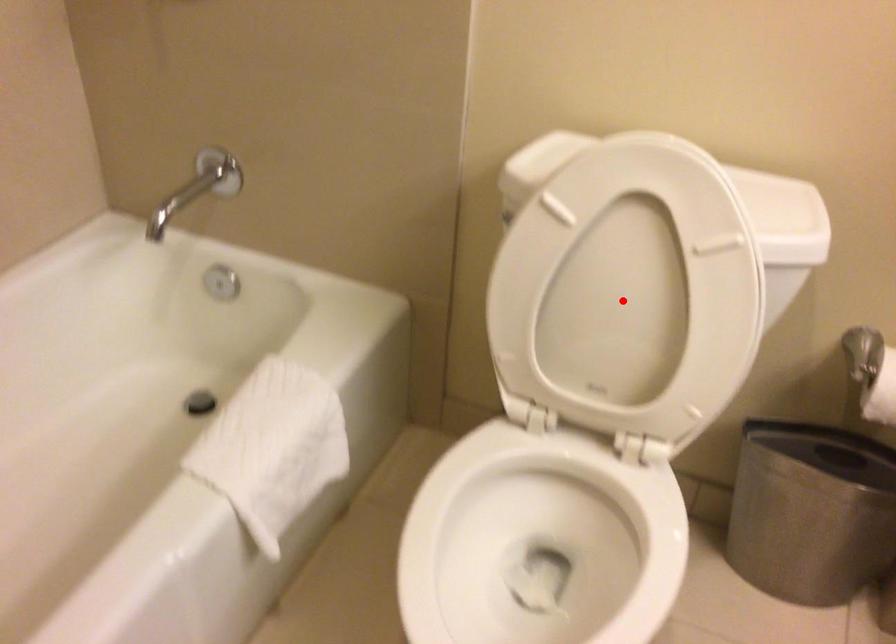
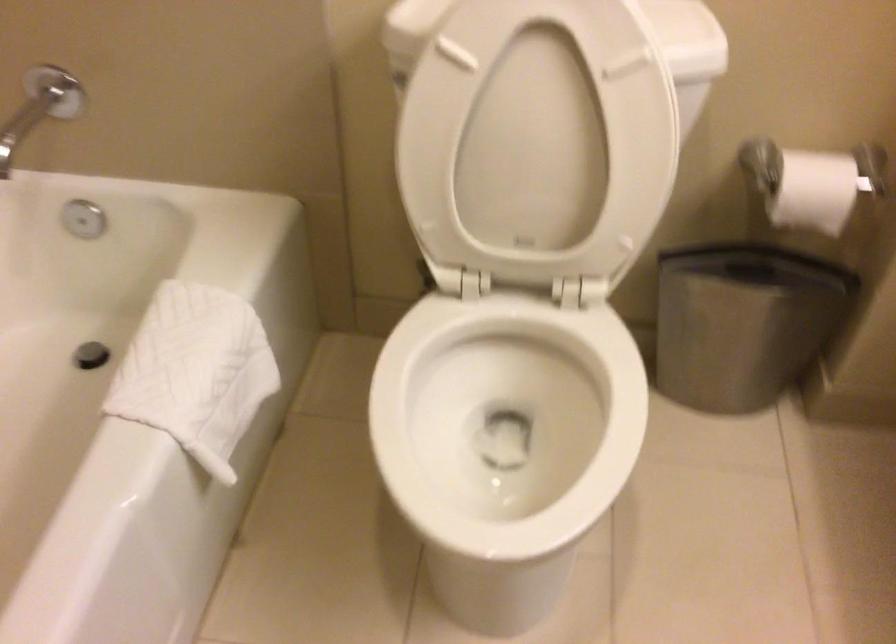
Locate, in the second image, the point that corresponds to the highlighted location in the first image.

(538, 140)